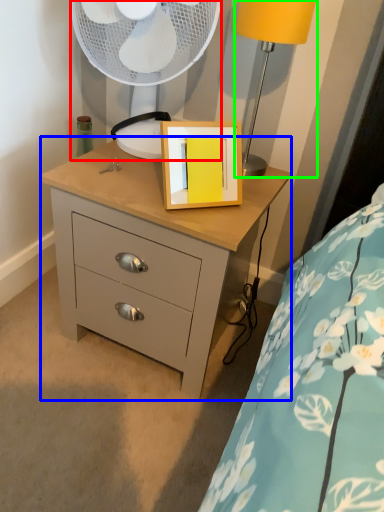
Question: Which object is positioned closest to mechanical fan (highlighted by a red box)? Select from chest of drawers (highlighted by a blue box) and table lamp (highlighted by a green box).

Choices:
 (A) chest of drawers
 (B) table lamp

Answer: (B)